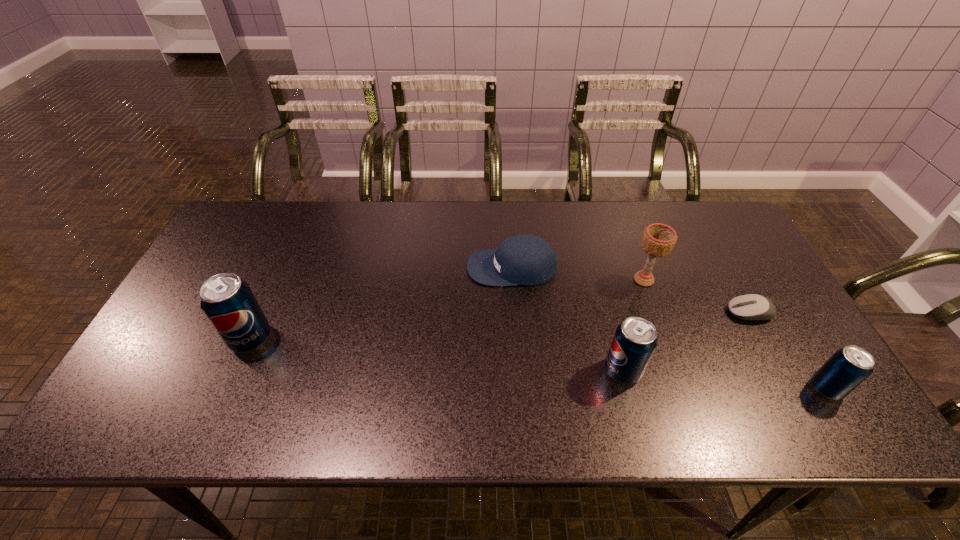
Find the location of a particular element. soda can that is at the right edge is located at coordinates (848, 367).

What are the coordinates of `computer equipment located at the right edge` in the screenshot? It's located at (754, 307).

At what (x,y) coordinates should I click in order to perform the action: click on object at the near right corner. Please return your answer as a coordinate pair (x, y). Looking at the image, I should click on (848, 367).

Locate an element on the screen. The image size is (960, 540). blank area at the far edge is located at coordinates (x=343, y=233).

Find the location of a particular element. This screenshot has height=540, width=960. free location at the near edge is located at coordinates (424, 379).

Locate an element on the screen. vacant space at the left edge of the desktop is located at coordinates (243, 249).

In the image, there is a desktop. Find the location of `free space at the near left corner`. free space at the near left corner is located at coordinates (157, 374).

You are a GUI agent. You are given a task and a screenshot of the screen. Output one action in this format:
    pyautogui.click(x=<x>, y=<y>)
    Task: Click on the free space between the computer equipment and the chalice
    The height and width of the screenshot is (540, 960).
    Given the screenshot: What is the action you would take?
    pyautogui.click(x=697, y=296)

Where is `free spot between the fourth object from left to right and the baseball cap`? The height and width of the screenshot is (540, 960). free spot between the fourth object from left to right and the baseball cap is located at coordinates (578, 274).

Find the location of `free spot between the shortest soda can and the third object from left to right`. free spot between the shortest soda can and the third object from left to right is located at coordinates (725, 380).